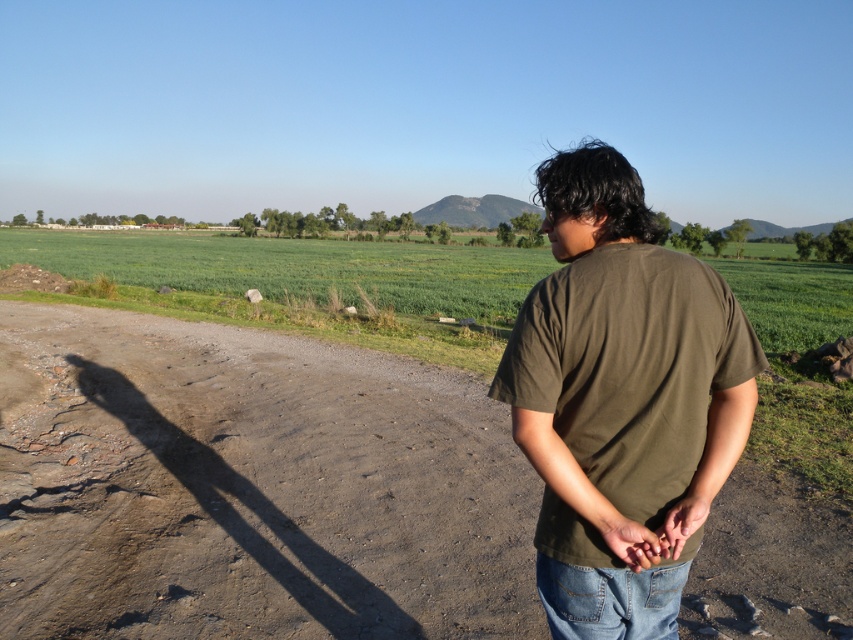
Question: Among these points, which one is nearest to the camera?

Choices:
 (A) (618, 588)
 (B) (128, 257)
 (C) (445, 369)

Answer: (A)

Question: Is dirt track at center to the left of olive green t-shirt at center from the viewer's perspective?

Choices:
 (A) yes
 (B) no

Answer: (A)

Question: Which of these objects is positioned farthest from the olive green t-shirt at center?

Choices:
 (A) jeans at lower right
 (B) dirt track at center
 (C) green grass field at center

Answer: (C)

Question: Can you confirm if olive green t-shirt at center is positioned above jeans at lower right?

Choices:
 (A) no
 (B) yes

Answer: (B)

Question: Which object appears closest to the camera in this image?

Choices:
 (A) dirt track at center
 (B) olive green t-shirt at center

Answer: (B)

Question: Is dirt track at center positioned at the back of green grass field at center?

Choices:
 (A) no
 (B) yes

Answer: (A)